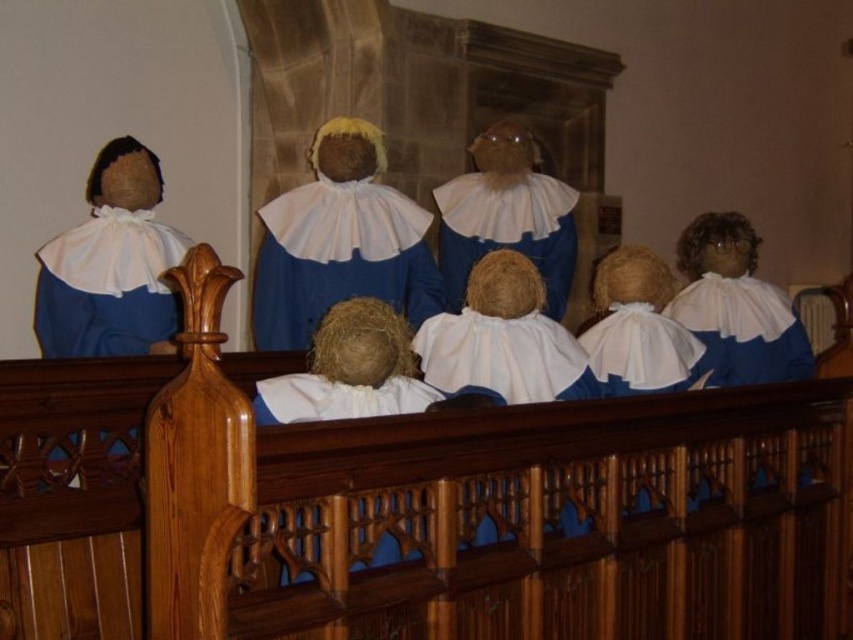
Who is shorter, matte blue dress at center or white cotton doll at center?

With less height is white cotton doll at center.

Consider the image. Can you confirm if matte blue dress at center is positioned to the left of white cotton doll at center?

Yes, matte blue dress at center is to the left of white cotton doll at center.

Does point (286, 266) come in front of point (440, 189)?

Yes.

This screenshot has height=640, width=853. I want to click on matte blue dress at center, so click(x=340, y=241).